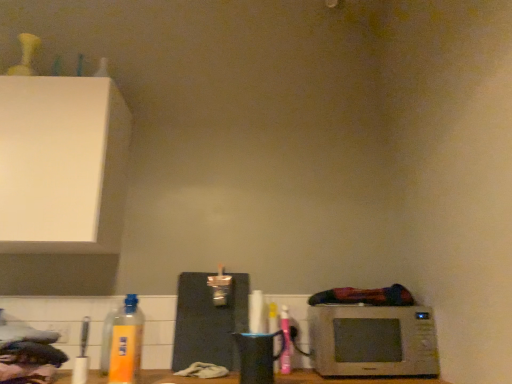
Question: In terms of size, does pink matte spray can at lower right, marked as the 1th bottle in a right-to-left arrangement, appear bigger or smaller than black matte cutting board at center?

Choices:
 (A) small
 (B) big

Answer: (A)

Question: Is pink matte spray can at lower right, the 3th bottle positioned from the left, wider or thinner than black matte cutting board at center?

Choices:
 (A) thin
 (B) wide

Answer: (A)

Question: Which object is positioned farthest from the yellow matte bottle at lower left, placed as the 2th bottle when sorted from back to front?

Choices:
 (A) pink matte spray can at lower right, marked as the 1th bottle in a right-to-left arrangement
 (B) white plastic electric outlet at lower left
 (C) yellow matte bottle at lower left, marked as the 3th bottle in a back-to-front arrangement
 (D) black matte cutting board at center
 (E) silver metallic microwave at lower right

Answer: (E)

Question: Estimate the real-world distances between objects in this image. Which object is closer to the white plastic electric outlet at lower left?

Choices:
 (A) black matte cutting board at center
 (B) yellow matte bottle at lower left, marked as the 3th bottle in a back-to-front arrangement
 (C) silver metallic microwave at lower right
 (D) yellow matte bottle at lower left, which appears as the 3th bottle when viewed from the right
 (E) pink matte spray can at lower right, the 3th bottle positioned from the left

Answer: (D)